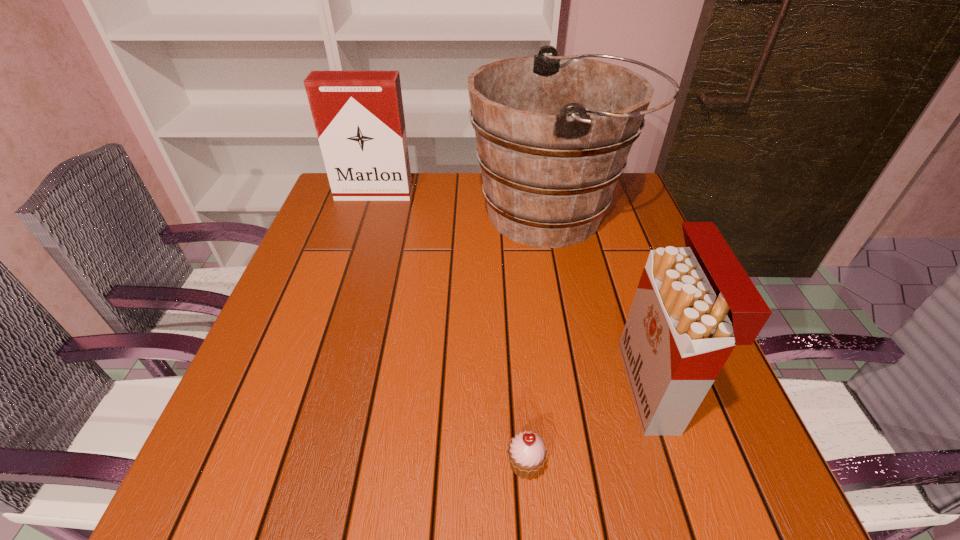
Find the location of a particular element. The height and width of the screenshot is (540, 960). blank region between the bucket and the shortest object is located at coordinates (540, 339).

At what (x,y) coordinates should I click in order to perform the action: click on vacant area between the bucket and the nearest object. Please return your answer as a coordinate pair (x, y). This screenshot has height=540, width=960. Looking at the image, I should click on (540, 339).

Locate an element on the screen. The width and height of the screenshot is (960, 540). free space between the nearer cigarette case and the leftmost object is located at coordinates (514, 291).

Locate an element on the screen. unoccupied area between the right cigarette case and the bucket is located at coordinates (603, 301).

You are a GUI agent. You are given a task and a screenshot of the screen. Output one action in this format:
    pyautogui.click(x=<x>, y=<y>)
    Task: Click on the free space between the bucket and the farther cigarette case
    The width and height of the screenshot is (960, 540).
    Given the screenshot: What is the action you would take?
    pyautogui.click(x=464, y=204)

This screenshot has width=960, height=540. In order to click on object that is the closest to the nearest object in this screenshot , I will do `click(694, 304)`.

Identify which object is the closest to the bucket. Please provide its 2D coordinates. Your answer should be formatted as a tuple, i.e. [(x, y)], where the tuple contains the x and y coordinates of a point satisfying the conditions above.

[(359, 118)]

Find the location of a particular element. This screenshot has height=540, width=960. free location that satisfies the following two spatial constraints: 1. on the front-facing side of the farther cigarette case; 2. on the left side of the cupcake is located at coordinates (287, 464).

This screenshot has width=960, height=540. I want to click on vacant space that satisfies the following two spatial constraints: 1. with the lid open on the right cigarette case; 2. on the front side of the nearest object, so click(x=679, y=464).

Where is `blank space that satisfies the following two spatial constraints: 1. on the front-facing side of the leftmost object; 2. on the left side of the cupcake`? This screenshot has width=960, height=540. blank space that satisfies the following two spatial constraints: 1. on the front-facing side of the leftmost object; 2. on the left side of the cupcake is located at coordinates (287, 464).